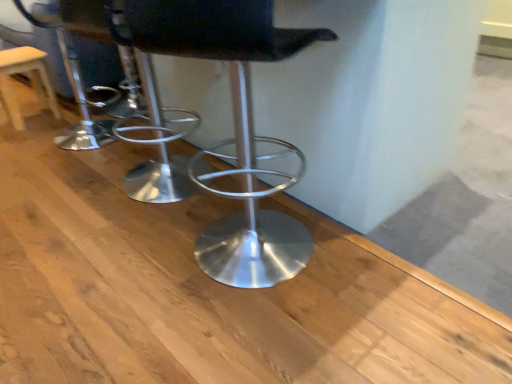
Question: In terms of height, does metallic silver stool at center look taller or shorter compared to wooden stool at left?

Choices:
 (A) tall
 (B) short

Answer: (A)

Question: From a real-world perspective, is metallic silver stool at center above or below wooden stool at left?

Choices:
 (A) below
 (B) above

Answer: (B)

Question: Relative to wooden stool at left, is metallic silver stool at center in front or behind?

Choices:
 (A) behind
 (B) front

Answer: (B)

Question: Is wooden stool at left in front of or behind metallic silver stool at center in the image?

Choices:
 (A) front
 (B) behind

Answer: (B)

Question: Looking at their shapes, would you say wooden stool at left is wider or thinner than metallic silver stool at center?

Choices:
 (A) wide
 (B) thin

Answer: (B)

Question: Is point (14, 66) closer or farther from the camera than point (279, 36)?

Choices:
 (A) farther
 (B) closer

Answer: (A)

Question: Is wooden stool at left taller or shorter than metallic silver stool at center?

Choices:
 (A) short
 (B) tall

Answer: (A)